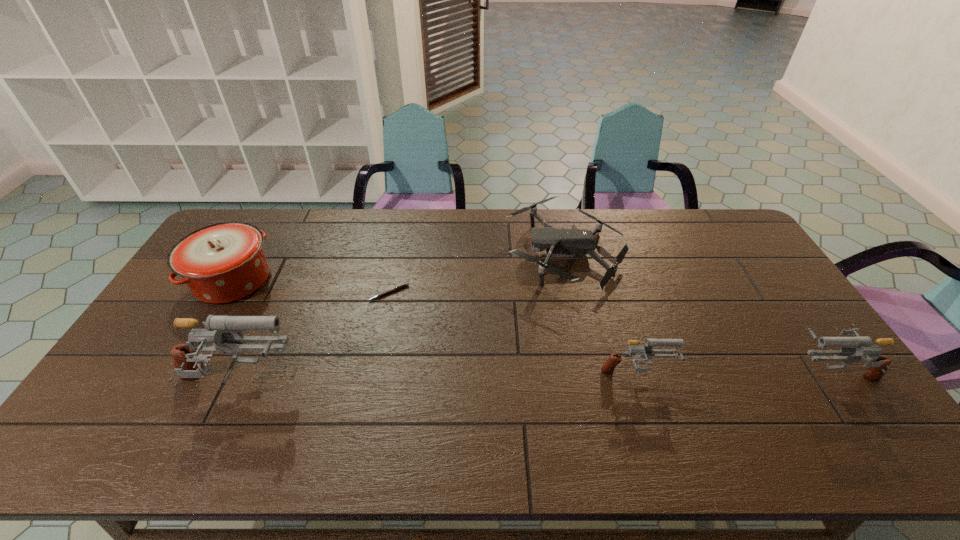
To achieve even spacing by inserting another gun among them, please point to a vacant spot for this new gun. Please provide its 2D coordinates. Your answer should be formatted as a tuple, i.e. [(x, y)], where the tuple contains the x and y coordinates of a point satisfying the conditions above.

[(439, 379)]